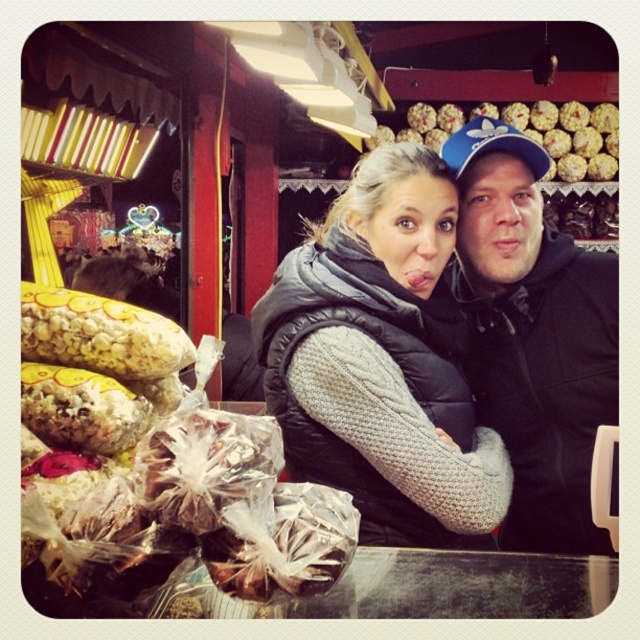
Which of these two, black hoodie at center or shiny chocolate truffle at upper right, stands taller?

black hoodie at center is taller.

Can you confirm if black hoodie at center is wider than shiny chocolate truffle at upper right?

No, black hoodie at center is not wider than shiny chocolate truffle at upper right.

Is point (497, 332) more distant than point (573, 170)?

No, (497, 332) is in front of (573, 170).

Locate an element on the screen. This screenshot has height=640, width=640. black hoodie at center is located at coordinates (532, 336).

Measure the distance between point (24, 538) and camera.

35.00 inches

Is shiny metallic popcorn at left further to camera compared to shiny chocolate truffle at upper right?

No, shiny metallic popcorn at left is closer to the viewer.

Describe the element at coordinates (176, 500) in the screenshot. I see `shiny metallic popcorn at left` at that location.

You are a GUI agent. You are given a task and a screenshot of the screen. Output one action in this format:
    pyautogui.click(x=<x>, y=<y>)
    Task: Click on the shiny metallic popcorn at left
    Image resolution: width=640 pixels, height=640 pixels.
    Given the screenshot: What is the action you would take?
    pyautogui.click(x=176, y=500)

Is gray quilted vest at center below shiny chocolate truffle at upper right?

Correct, gray quilted vest at center is located below shiny chocolate truffle at upper right.

This screenshot has width=640, height=640. Find the location of `gray quilted vest at center`. gray quilted vest at center is located at coordinates (381, 360).

The image size is (640, 640). Identify the location of gray quilted vest at center. (381, 360).